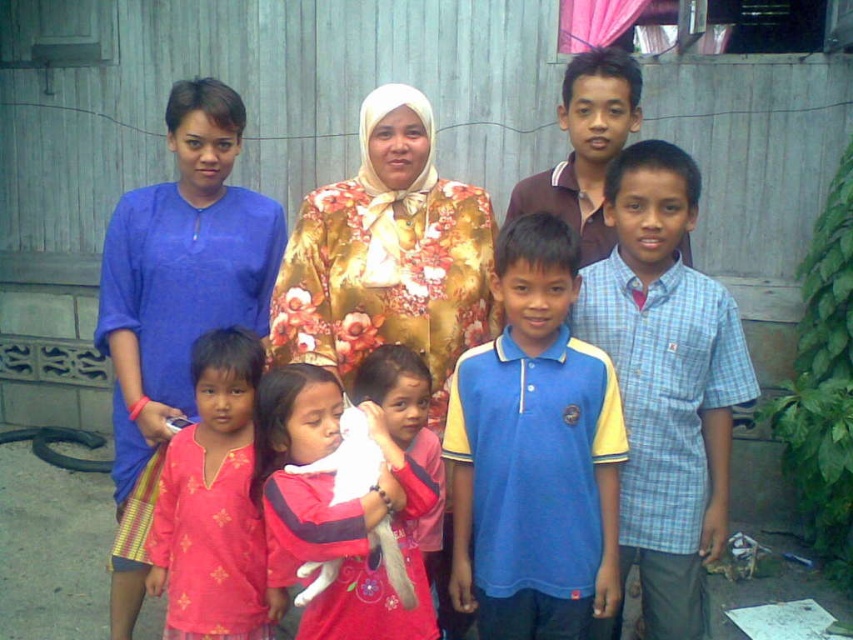
Question: Can you confirm if blue cotton shirt at left is wider than matte pink shirt at center?

Choices:
 (A) no
 (B) yes

Answer: (B)

Question: Which is nearer to the pink fabric at center?

Choices:
 (A) matte pink shirt at center
 (B) blue cotton shirt at center
 (C) blue/yellow polo shirt at center

Answer: (A)

Question: Does blue cotton shirt at left appear under blue cotton shirt at center?

Choices:
 (A) no
 (B) yes

Answer: (B)

Question: Is matte pink shirt at center closer to the viewer compared to pink fabric at center?

Choices:
 (A) no
 (B) yes

Answer: (B)

Question: Which point is closer to the camera taking this photo?

Choices:
 (A) (397, 240)
 (B) (236, 230)
 (C) (543, 620)

Answer: (C)

Question: Which point is farther to the camera?

Choices:
 (A) (373, 118)
 (B) (303, 490)

Answer: (A)